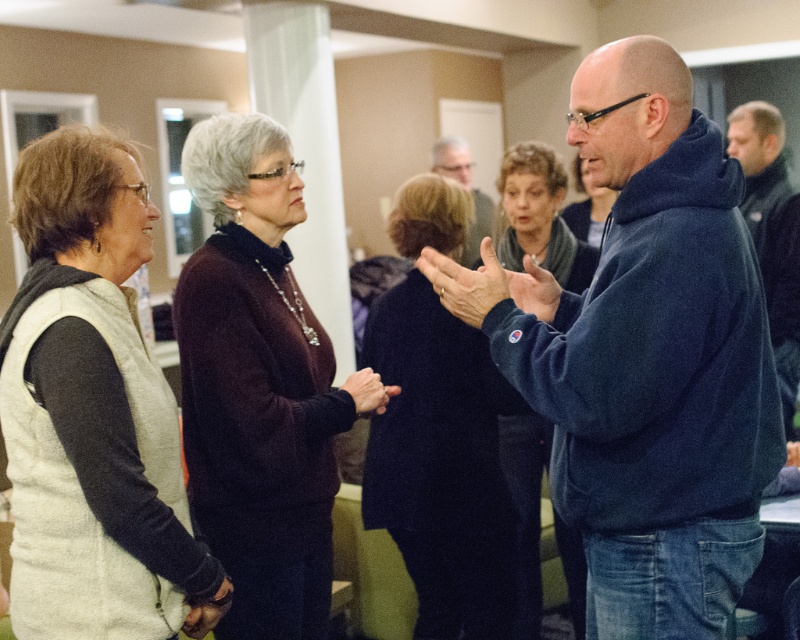
You are an artist trying to draw the hands in the image. Which hand, the smooth skin hand at center or the matte blue hand at center, should you depict as wider?

The smooth skin hand at center should be depicted as wider since it might be wider than the matte blue hand at center according to the description.

You are standing in a room where two people are wearing the dark blue fleece at center and the matte black sweater at center. Which one is positioned more to the right?

The dark blue fleece at center is positioned more to the right than the matte black sweater at center.

What color is the object located at the coordinates point (656, 360)?

The object located at point (656, 360) is dark blue fleece.